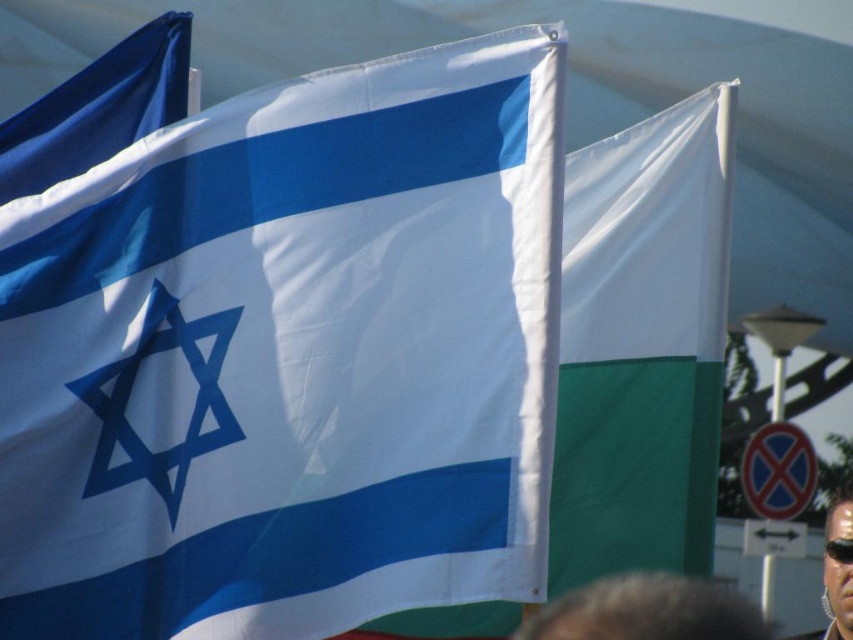
Question: Can you confirm if sunglasses at upper right is positioned below transparent plastic goggles at lower right?

Choices:
 (A) no
 (B) yes

Answer: (B)

Question: Observing the image, what is the correct spatial positioning of blue fabric flag at upper left in reference to transparent plastic goggles at lower right?

Choices:
 (A) left
 (B) right

Answer: (A)

Question: Which of the following is the closest to the observer?

Choices:
 (A) (x=48, y=180)
 (B) (x=838, y=547)

Answer: (A)

Question: Which object is positioned farthest from the transparent plastic goggles at lower right?

Choices:
 (A) sunglasses at upper right
 (B) blue fabric flag at upper left
 (C) blue fabric flag at center

Answer: (A)

Question: Can you confirm if blue fabric flag at upper left is positioned to the right of transparent plastic goggles at lower right?

Choices:
 (A) no
 (B) yes

Answer: (A)

Question: Estimate the real-world distances between objects in this image. Which object is farther from the sunglasses at upper right?

Choices:
 (A) blue fabric flag at center
 (B) blue fabric flag at upper left

Answer: (A)